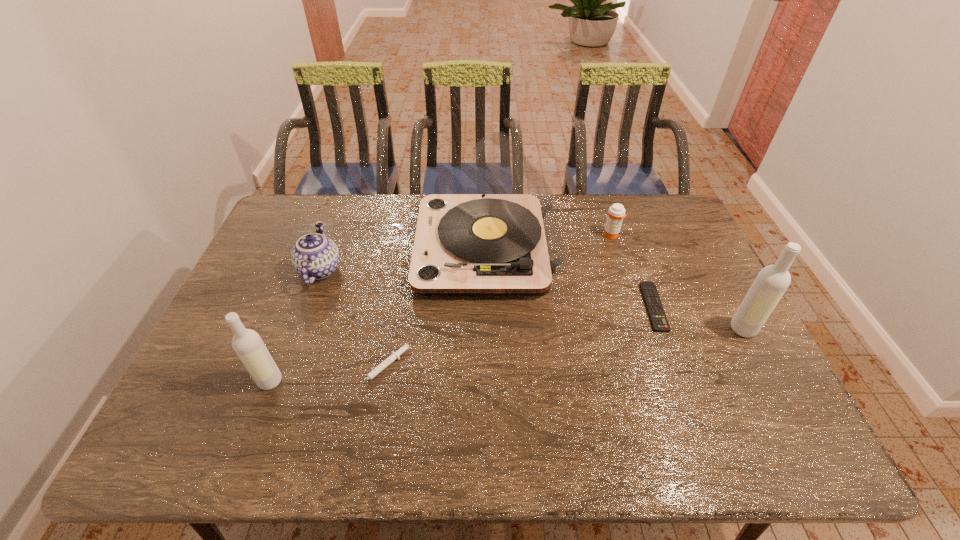
Please determine a free point for an extra vodka to ensure balance. Please provide its 2D coordinates. Your answer should be formatted as a tuple, i.e. [(x, y)], where the tuple contains the x and y coordinates of a point satisfying the conditions above.

[(518, 354)]